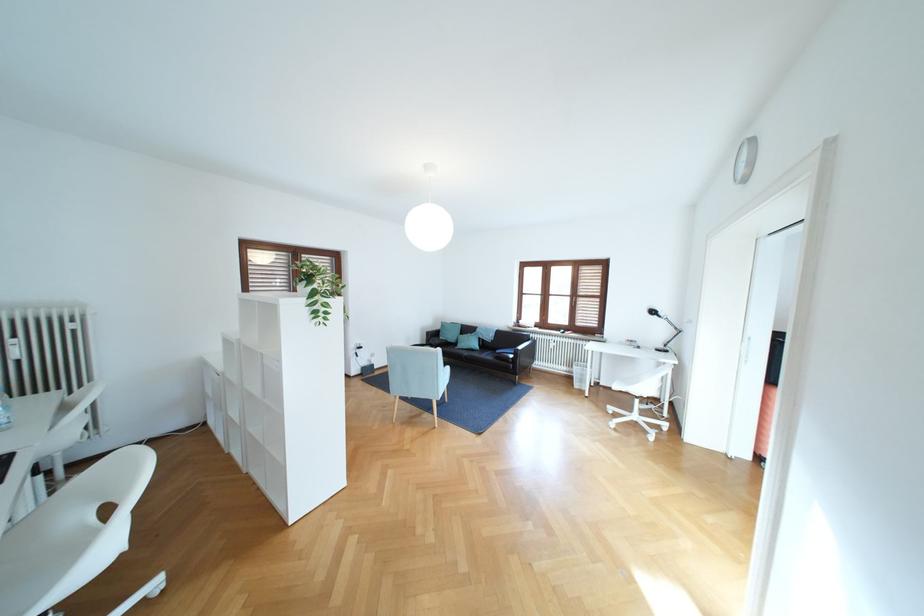
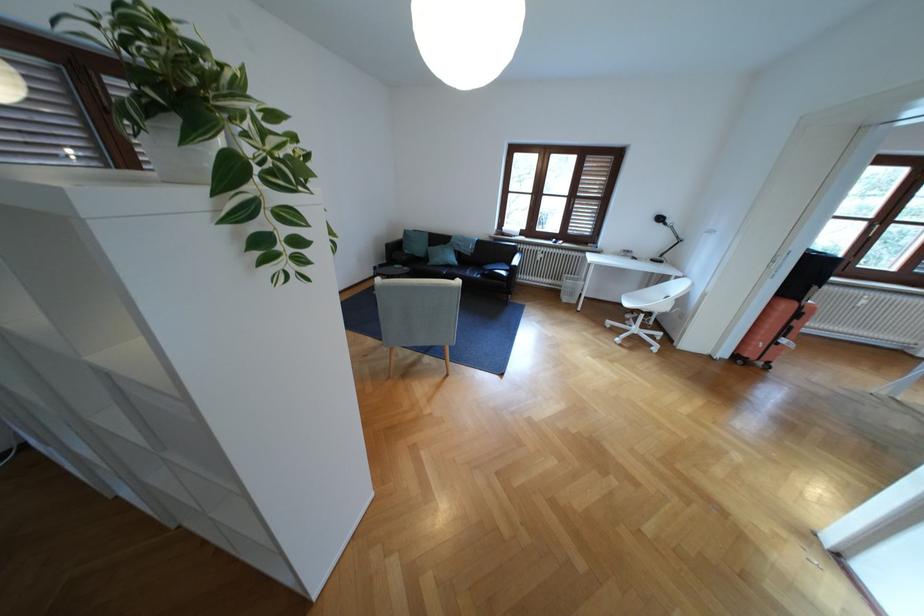
The point at (621, 408) is marked in the first image. Where is the corresponding point in the second image?

(618, 323)